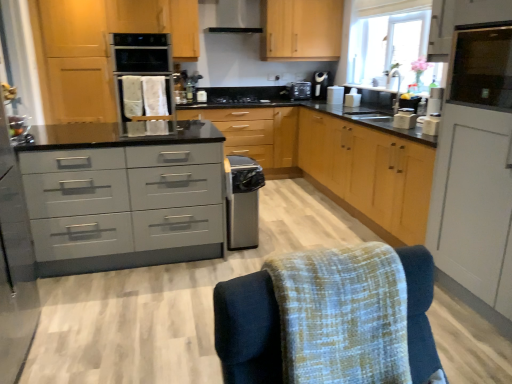
What do you see at coordinates (98, 48) in the screenshot?
I see `wooden cabinet at center, the third cabinetry when ordered from front to back` at bounding box center [98, 48].

Locate an element on the screen. The height and width of the screenshot is (384, 512). satin silver dishwasher at center is located at coordinates pyautogui.click(x=242, y=201).

This screenshot has width=512, height=384. Describe the element at coordinates (201, 96) in the screenshot. I see `satin silver toaster at center, marked as the fifth appliance in a right-to-left arrangement` at that location.

This screenshot has width=512, height=384. Find the location of `black plastic toaster at upper center, which is the first appliance in back-to-front order`. black plastic toaster at upper center, which is the first appliance in back-to-front order is located at coordinates (298, 90).

What is the approximate height of transparent glass window screen at upper right?

It is 15.79 inches.

Find the location of a particular element. Image resolution: width=512 pixels, height=384 pixels. transparent glass window screen at upper right is located at coordinates coord(481,66).

Describe the element at coordinates (248, 330) in the screenshot. I see `textured fabric swivel chair at lower right` at that location.

Where is `textured fabric swivel chair at lower right`? Image resolution: width=512 pixels, height=384 pixels. textured fabric swivel chair at lower right is located at coordinates (248, 330).

Locate an element on the screen. This screenshot has width=512, height=384. wooden cabinet at center, arranged as the 1th cabinetry when viewed from the left is located at coordinates (98, 48).

Considering the sizes of objects transparent glass window at upper right and wooden cabinet at center, the third cabinetry when ordered from front to back, in the image provided, who is thinner, transparent glass window at upper right or wooden cabinet at center, the third cabinetry when ordered from front to back,?

With smaller width is transparent glass window at upper right.

Between transparent glass window at upper right and wooden cabinet at center, arranged as the 1th cabinetry when viewed from the left, which one has less height?

transparent glass window at upper right is shorter.

Is wooden cabinet at center, the second cabinetry in the back-to-front sequence, located within transparent glass window at upper right?

Definitely not — wooden cabinet at center, the second cabinetry in the back-to-front sequence, is not inside transparent glass window at upper right.

How far apart are transparent glass window at upper right and wooden cabinet at center, arranged as the 1th cabinetry when viewed from the left?

transparent glass window at upper right is 2.47 meters from wooden cabinet at center, arranged as the 1th cabinetry when viewed from the left.

Which is nearer, (329,92) or (231,368)?

Point (329,92) appears to be farther away from the viewer than point (231,368).

In the scene shown: Is white plastic toaster at upper center, marked as the 3th appliance in a bottom-to-top arrangement, to the left of textured fabric swivel chair at lower right from the viewer's perspective?

No, white plastic toaster at upper center, marked as the 3th appliance in a bottom-to-top arrangement, is not to the left of textured fabric swivel chair at lower right.

Is white plastic toaster at upper center, positioned as the 3th appliance in left-to-right order, positioned far away from textured fabric swivel chair at lower right?

white plastic toaster at upper center, positioned as the 3th appliance in left-to-right order, is far away from textured fabric swivel chair at lower right.

Is white plastic toaster at upper center, the 3th appliance in the back-to-front sequence, bigger or smaller than textured fabric swivel chair at lower right?

Considering their sizes, white plastic toaster at upper center, the 3th appliance in the back-to-front sequence, takes up less space than textured fabric swivel chair at lower right.

Measure the distance from wooden cabinet at center, positioned as the second cabinetry in left-to-right order, to satin black exhaust hood at upper center.

1.35 meters.

Which object is thinner, wooden cabinet at center, positioned as the second cabinetry in left-to-right order, or satin black exhaust hood at upper center?

satin black exhaust hood at upper center.

Where is `exhaust hood located above the wooden cabinet at center, the fourth cabinetry positioned from the front (from a real-world perspective)`? exhaust hood located above the wooden cabinet at center, the fourth cabinetry positioned from the front (from a real-world perspective) is located at coordinates (237, 17).

What's the angular difference between wooden cabinet at center, the 1th cabinetry in the back-to-front sequence, and satin black exhaust hood at upper center's facing directions?

The facing directions of wooden cabinet at center, the 1th cabinetry in the back-to-front sequence, and satin black exhaust hood at upper center are 0.975 degrees apart.

How many degrees apart are the facing directions of transparent glass window screen at upper right and white matte cabinet at right, which is the 4th cabinetry from left to right?

The angle between the facing direction of transparent glass window screen at upper right and the facing direction of white matte cabinet at right, which is the 4th cabinetry from left to right, is 0.0784 degrees.

Which is in front, transparent glass window screen at upper right or white matte cabinet at right, which is the 4th cabinetry from left to right?

white matte cabinet at right, which is the 4th cabinetry from left to right, is more forward.

From the image's perspective, which is above, transparent glass window screen at upper right or white matte cabinet at right, which is the 4th cabinetry from left to right?

transparent glass window screen at upper right, from the image's perspective.

Is transparent glass window screen at upper right turned away from white matte cabinet at right, the first cabinetry viewed from the right?

That's right, transparent glass window screen at upper right is facing away from white matte cabinet at right, the first cabinetry viewed from the right.

From the image's perspective, which object appears higher, matte wood cabinet at upper right, positioned as the second cabinetry in right-to-left order, or wooden cabinet at center, positioned as the second cabinetry in left-to-right order?

From the image's view, matte wood cabinet at upper right, positioned as the second cabinetry in right-to-left order, is above.

Is matte wood cabinet at upper right, the 2th cabinetry when ordered from front to back, looking in the opposite direction of wooden cabinet at center, the third cabinetry positioned from the right?

No, matte wood cabinet at upper right, the 2th cabinetry when ordered from front to back, is not facing the opposite direction of wooden cabinet at center, the third cabinetry positioned from the right.

From a real-world perspective, between matte wood cabinet at upper right, which is the third cabinetry from back to front, and wooden cabinet at center, the 1th cabinetry in the back-to-front sequence, who is vertically higher?

From a 3D spatial view, matte wood cabinet at upper right, which is the third cabinetry from back to front, is above.

Can you tell me how much matte wood cabinet at upper right, acting as the 3th cabinetry starting from the left, and wooden cabinet at center, the third cabinetry positioned from the right, differ in facing direction?

There is a 90.1-degree angle between the facing directions of matte wood cabinet at upper right, acting as the 3th cabinetry starting from the left, and wooden cabinet at center, the third cabinetry positioned from the right.

From a real-world perspective, is transparent glass window screen at upper right physically above satin black exhaust hood at upper center?

Actually, transparent glass window screen at upper right is physically below satin black exhaust hood at upper center in the real world.

From the picture: How much distance is there between transparent glass window screen at upper right and satin black exhaust hood at upper center?

transparent glass window screen at upper right and satin black exhaust hood at upper center are 3.52 meters apart from each other.

Do you think transparent glass window screen at upper right is within satin black exhaust hood at upper center, or outside of it?

transparent glass window screen at upper right is not enclosed by satin black exhaust hood at upper center.

Where is `kitchen appliance below the transparent glass window at upper right (from a real-world perspective)`? This screenshot has height=384, width=512. kitchen appliance below the transparent glass window at upper right (from a real-world perspective) is located at coordinates (141, 52).

Are satin black oven at upper center and transparent glass window at upper right making contact?

There is a gap between satin black oven at upper center and transparent glass window at upper right.

Does satin black oven at upper center have a lesser height compared to transparent glass window at upper right?

Correct, satin black oven at upper center is not as tall as transparent glass window at upper right.

From a real-world perspective, who is located higher, satin black oven at upper center or transparent glass window at upper right?

transparent glass window at upper right, from a real-world perspective.

Locate an element on the screen. The height and width of the screenshot is (384, 512). window on the right of wooden cabinet at center, acting as the fourth cabinetry starting from the right is located at coordinates (383, 39).

Image resolution: width=512 pixels, height=384 pixels. I want to click on swivel chair in front of the white plastic toaster at upper center, marked as the 3th appliance in a bottom-to-top arrangement, so click(x=248, y=330).

Which object lies further to the anchor point satin black coffee machine at upper right, white plastic toaster at right, the first appliance viewed from the front, or satin silver toaster at center, arranged as the second appliance when viewed from the top?

The object further to satin black coffee machine at upper right is white plastic toaster at right, the first appliance viewed from the front.

Looking at the image, which one is located further to wooden cabinet at center, the 1th cabinetry in the back-to-front sequence, wooden cabinet at center, arranged as the 1th cabinetry when viewed from the left, or satin black exhaust hood at upper center?

Based on the image, satin black exhaust hood at upper center appears to be further to wooden cabinet at center, the 1th cabinetry in the back-to-front sequence.

Which object lies nearer to the anchor point black plastic toaster at upper center, placed as the 1th appliance when sorted from top to bottom, satin silver toaster at center, placed as the 4th appliance when sorted from bottom to top, or wooden cabinet at center, acting as the fourth cabinetry starting from the right?

Among the two, satin silver toaster at center, placed as the 4th appliance when sorted from bottom to top, is located nearer to black plastic toaster at upper center, placed as the 1th appliance when sorted from top to bottom.

From the image, which object appears to be farther from black plastic toaster at upper center, which appears as the fourth appliance when viewed from the right, satin black exhaust hood at upper center or white matte cabinet at right, the 1th cabinetry in the front-to-back sequence?

white matte cabinet at right, the 1th cabinetry in the front-to-back sequence, lies further to black plastic toaster at upper center, which appears as the fourth appliance when viewed from the right, than the other object.

Which object lies further to the anchor point black matte stove at center, white plastic toaster at right, which is the fourth appliance from top to bottom, or white matte cabinet at right, the 1th cabinetry in the front-to-back sequence?

Among the two, white matte cabinet at right, the 1th cabinetry in the front-to-back sequence, is located further to black matte stove at center.

Looking at the image, which one is located further to wooden cabinet at center, acting as the fourth cabinetry starting from the right, white plastic toaster at right, the first appliance viewed from the front, or satin silver dishwasher at center?

white plastic toaster at right, the first appliance viewed from the front.

When comparing their distances from satin silver toaster at center, marked as the 1th appliance in a left-to-right arrangement, does matte wood cabinet at upper right, which is the third cabinetry from back to front, or white plastic toaster at upper center, the 3th appliance in the back-to-front sequence, seem further?

Among the two, matte wood cabinet at upper right, which is the third cabinetry from back to front, is located further to satin silver toaster at center, marked as the 1th appliance in a left-to-right arrangement.

Based on their spatial positions, is satin silver dishwasher at center or white matte cabinet at right, which ranks as the 4th cabinetry in back-to-front order, closer to black plastic toaster at upper center, which appears as the 2th appliance when viewed from the left?

Among the two, satin silver dishwasher at center is located nearer to black plastic toaster at upper center, which appears as the 2th appliance when viewed from the left.

The image size is (512, 384). I want to click on dish washer located between textured fabric swivel chair at lower right and satin black coffee machine at upper right in the depth direction, so click(x=242, y=201).

Where is `dish washer located between matte gray drawers at center and wooden cabinet at center, acting as the fourth cabinetry starting from the right, in the depth direction`? dish washer located between matte gray drawers at center and wooden cabinet at center, acting as the fourth cabinetry starting from the right, in the depth direction is located at coordinates (242, 201).

Locate an element on the screen. The height and width of the screenshot is (384, 512). kitchen appliance positioned between matte gray drawers at center and wooden cabinet at center, the 1th cabinetry in the back-to-front sequence, from near to far is located at coordinates click(141, 52).

I want to click on window screen between white matte cabinet at right, which is the 4th cabinetry from left to right, and white plastic toaster at upper center, marked as the 3th appliance in a bottom-to-top arrangement, in the front-back direction, so click(481, 66).